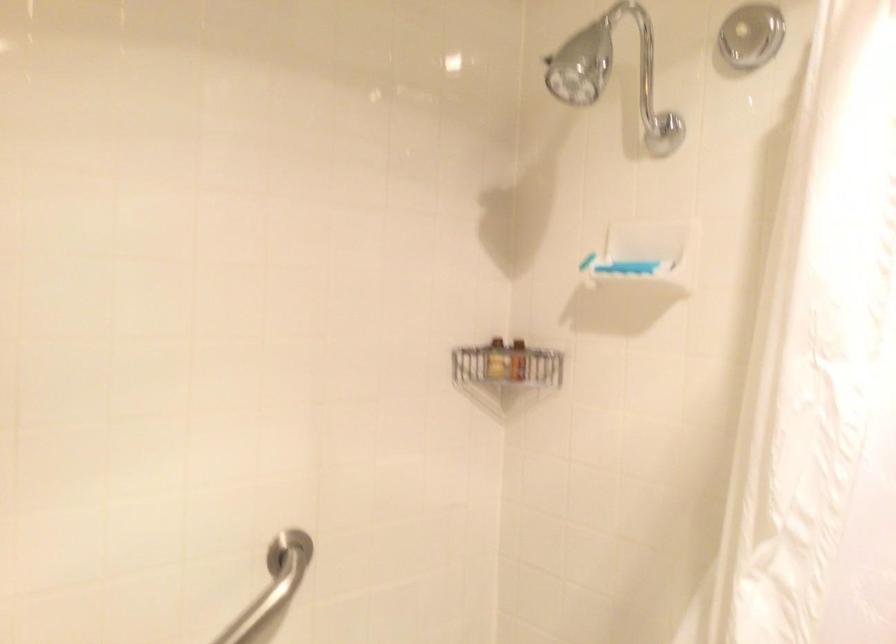
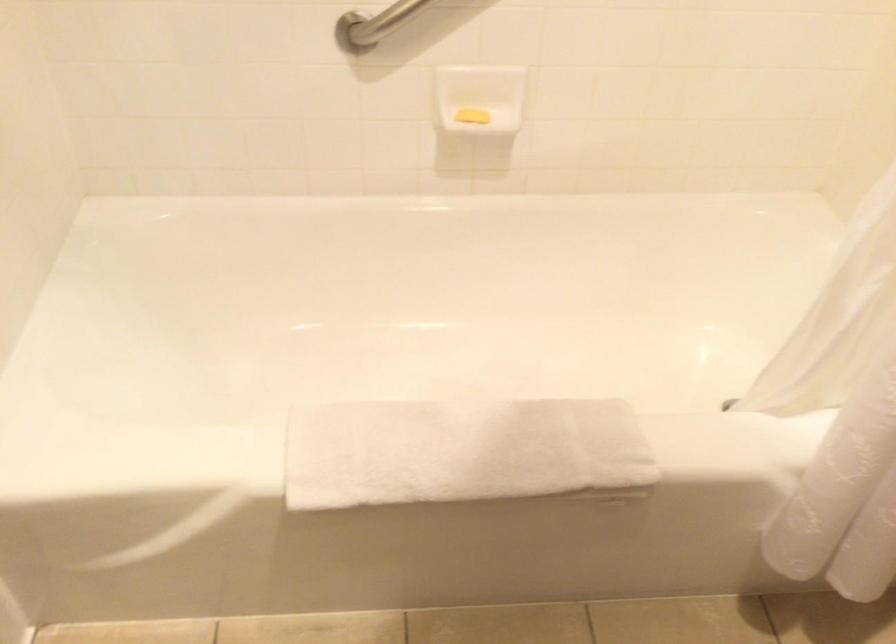
Looking at this image, the first image is from the beginning of the video and the second image is from the end. How did the camera likely rotate when shooting the video?

The camera rotated toward left-down.